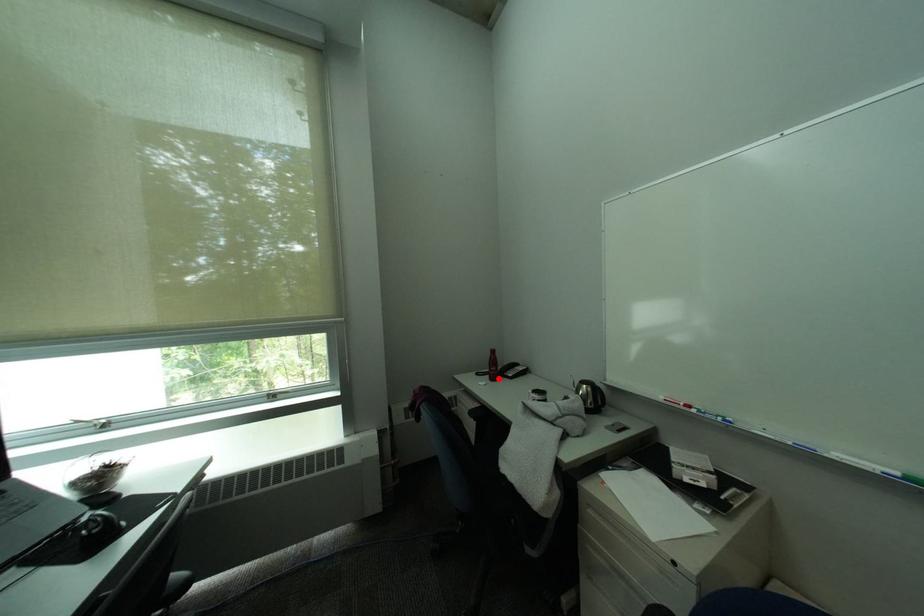
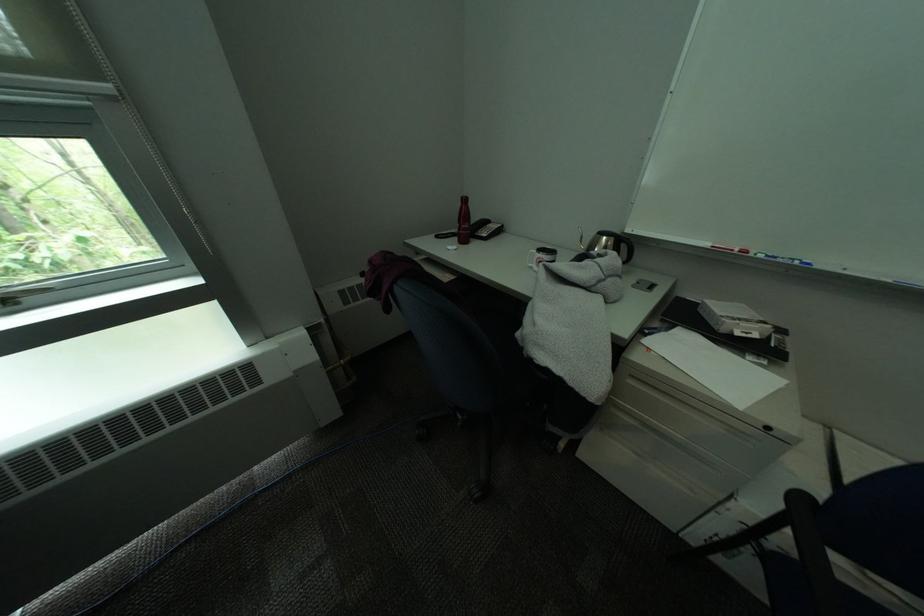
Find the pixel in the second image that matches the highlighted location in the first image.

(466, 241)